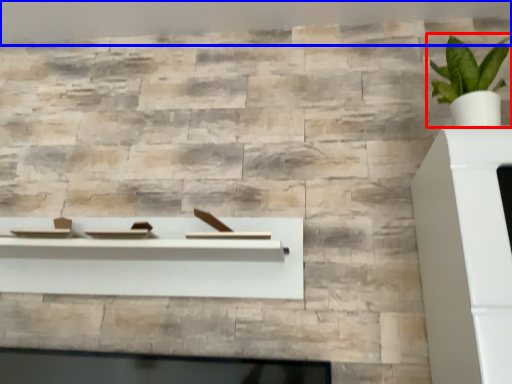
Question: Among these objects, which one is farthest to the camera, houseplant (highlighted by a red box) or backdrop (highlighted by a blue box)?

Choices:
 (A) houseplant
 (B) backdrop

Answer: (B)